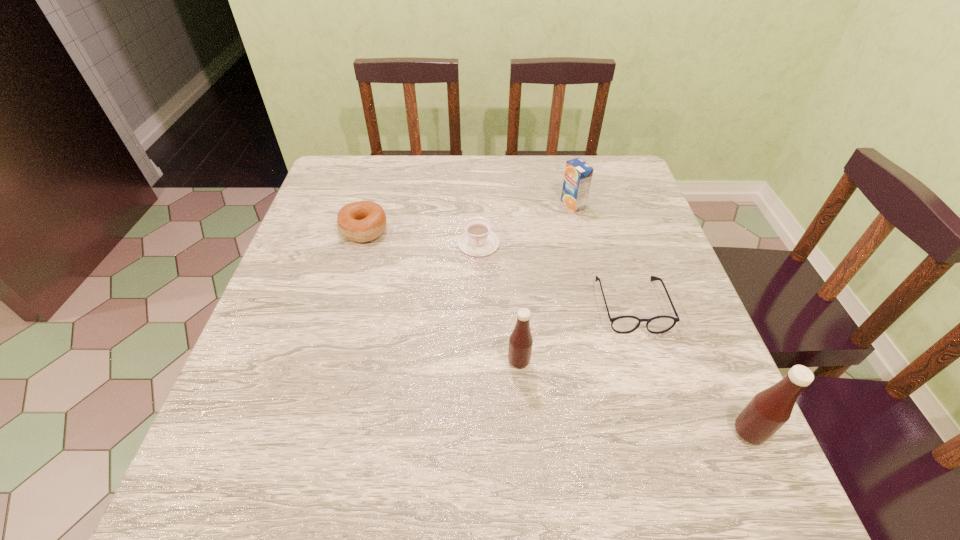
You are a GUI agent. You are given a task and a screenshot of the screen. Output one action in this format:
    pyautogui.click(x=<x>, y=<y>)
    Task: Click on the free space located 0.260m on the back of the nearest object
    This screenshot has width=960, height=540.
    Given the screenshot: What is the action you would take?
    pyautogui.click(x=692, y=304)

What are the coordinates of `vacant space located on the back of the leftmost object` in the screenshot? It's located at (372, 201).

This screenshot has width=960, height=540. Find the location of `vacant region located on the handle side of the fifth object from right to left`. vacant region located on the handle side of the fifth object from right to left is located at coordinates (478, 282).

Find the location of a particular element. The height and width of the screenshot is (540, 960). vacant point located on the left of the farthest object is located at coordinates (517, 205).

Find the location of a particular element. free space located on the front-facing side of the third nearest object is located at coordinates (658, 392).

Locate an element on the screen. object present at the far edge is located at coordinates (578, 174).

Locate an element on the screen. This screenshot has width=960, height=540. object that is at the near edge is located at coordinates (770, 409).

Locate an element on the screen. This screenshot has width=960, height=540. object situated at the left edge is located at coordinates (363, 221).

At what (x,y) coordinates should I click in order to perform the action: click on Tabasco sauce that is at the right edge. Please return your answer as a coordinate pair (x, y). The height and width of the screenshot is (540, 960). Looking at the image, I should click on (770, 409).

You are a GUI agent. You are given a task and a screenshot of the screen. Output one action in this format:
    pyautogui.click(x=<x>, y=<y>)
    Task: Click on the spectacles positioned at the right edge
    This screenshot has height=540, width=960.
    Given the screenshot: What is the action you would take?
    point(625,324)